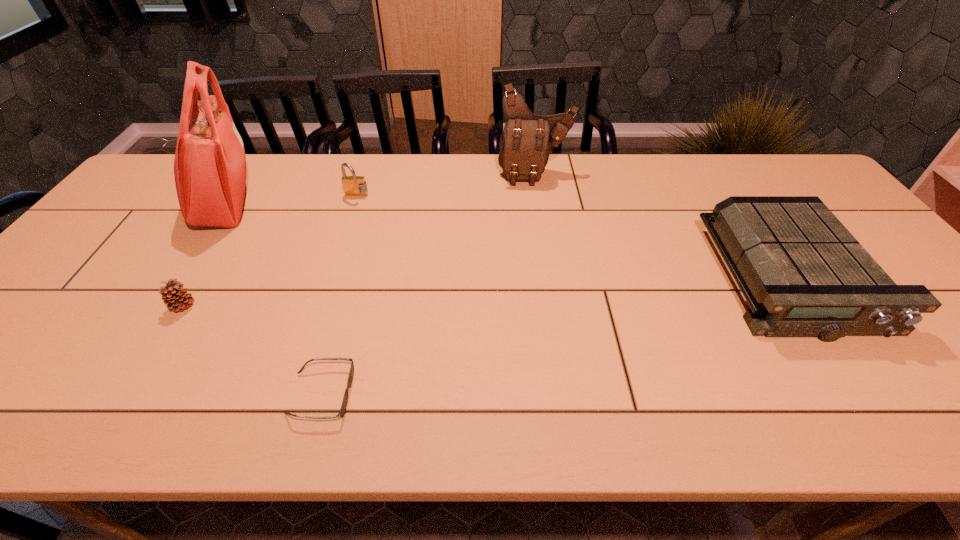
Identify the location of vacant space located on the side with the combination dials of the padlock. The height and width of the screenshot is (540, 960). (349, 217).

Identify the location of free region located 0.130m on the front panel of the rightmost object. (872, 397).

Find the location of a particular element. Image resolution: width=960 pixels, height=540 pixels. vacant space situated on the left of the pinecone is located at coordinates (29, 306).

I want to click on free point located on the front-facing side of the shortest object, so click(x=529, y=394).

The width and height of the screenshot is (960, 540). Identify the location of handbag positioned at the far edge. (210, 170).

At what (x,y) coordinates should I click in order to perform the action: click on shoulder bag that is at the far edge. Please return your answer as a coordinate pair (x, y). This screenshot has height=540, width=960. Looking at the image, I should click on (527, 140).

Find the location of a particular element. padlock located in the far edge section of the desktop is located at coordinates (353, 185).

At what (x,y) coordinates should I click in order to perform the action: click on object at the near edge. Please return your answer as a coordinate pair (x, y). The width and height of the screenshot is (960, 540). Looking at the image, I should click on (342, 411).

At what (x,y) coordinates should I click in order to perform the action: click on object present at the right edge. Please return your answer as a coordinate pair (x, y). Looking at the image, I should click on (803, 274).

This screenshot has width=960, height=540. What are the coordinates of `vacant position at the far edge of the desktop` in the screenshot? It's located at (296, 175).